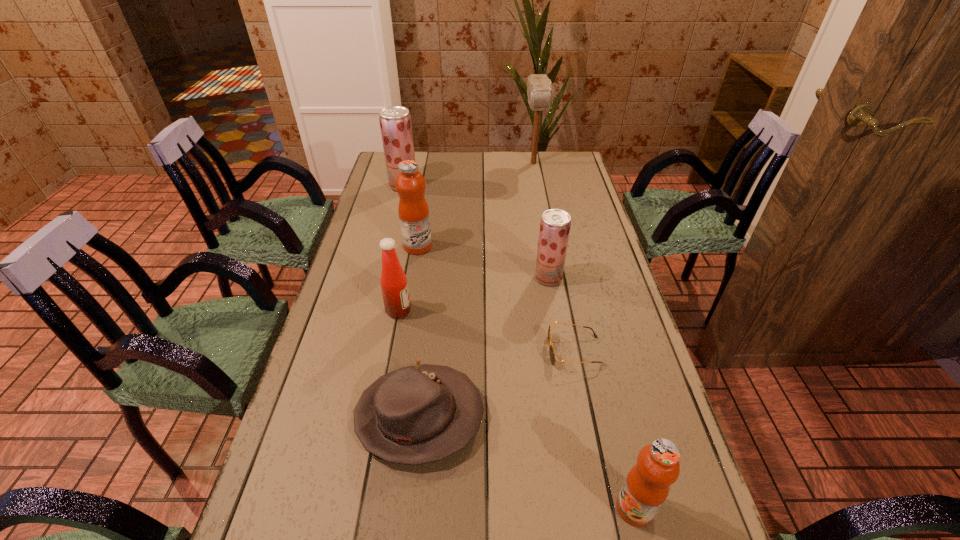
I want to click on free region located 0.240m on the front label of the rightmost fruit juice, so click(x=492, y=508).

Find the location of a particular element. The height and width of the screenshot is (540, 960). free space located on the front label of the rightmost fruit juice is located at coordinates point(497,508).

The image size is (960, 540). In order to click on free spot located 0.310m on the decorative side of the hat in this screenshot , I will do `click(621, 417)`.

Identify the location of vacant space located 0.310m on the lenses of the black sunglasses. (427, 351).

At what (x,y) coordinates should I click in order to perform the action: click on free location located 0.370m on the lenses of the black sunglasses. Please return your answer as a coordinate pair (x, y). The height and width of the screenshot is (540, 960). Looking at the image, I should click on (404, 351).

The image size is (960, 540). Find the location of `vacant point located on the lenses of the black sunglasses`. vacant point located on the lenses of the black sunglasses is located at coordinates (412, 351).

The image size is (960, 540). In order to click on mallet present at the far edge in this screenshot , I will do `click(539, 87)`.

Locate an element on the screen. The height and width of the screenshot is (540, 960). fruit juice located at the far edge is located at coordinates (395, 121).

Image resolution: width=960 pixels, height=540 pixels. Find the location of `fruit juice positioned at the left edge`. fruit juice positioned at the left edge is located at coordinates (395, 121).

Locate an element on the screen. The image size is (960, 540). condiment that is at the left edge is located at coordinates (393, 280).